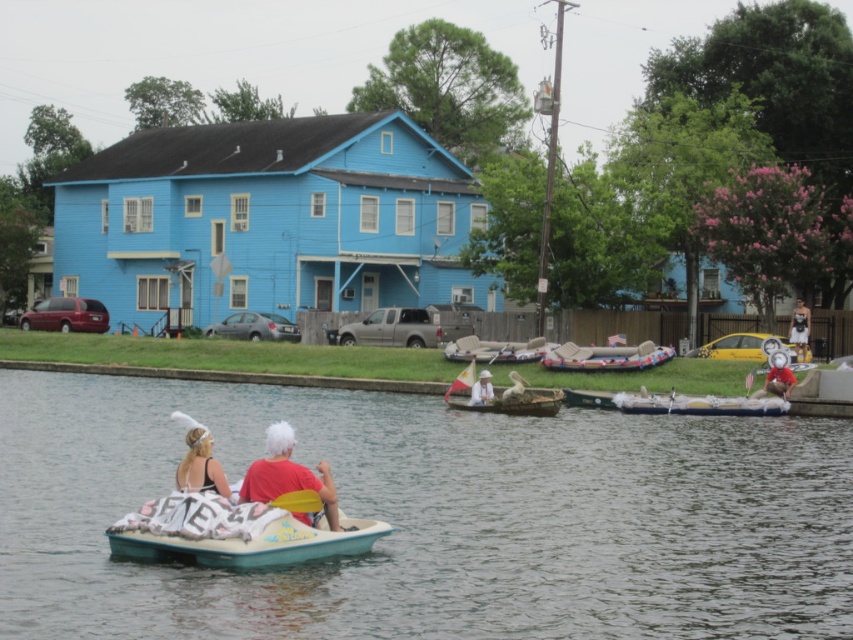
Which is above, red and white striped float at center or white cotton shirt at center?

white cotton shirt at center is above.

This screenshot has height=640, width=853. What do you see at coordinates (605, 356) in the screenshot?
I see `red and white striped float at center` at bounding box center [605, 356].

Find the location of a particular element. red and white striped float at center is located at coordinates (605, 356).

Can you confirm if teal plastic paddle boat at center is positioned to the right of white cotton shirt at center?

In fact, teal plastic paddle boat at center is to the left of white cotton shirt at center.

Who is positioned more to the right, teal plastic paddle boat at center or white cotton shirt at center?

Positioned to the right is white cotton shirt at center.

I want to click on teal plastic paddle boat at center, so click(233, 536).

Where is `teal plastic paddle boat at center`? The image size is (853, 640). teal plastic paddle boat at center is located at coordinates (233, 536).

Which of these two, blue plastic boat at center or matte black swimsuit at lower left, stands shorter?

matte black swimsuit at lower left is shorter.

Is the position of blue plastic boat at center less distant than that of matte black swimsuit at lower left?

Yes, it is in front of matte black swimsuit at lower left.

Describe the element at coordinates (432, 516) in the screenshot. The width and height of the screenshot is (853, 640). I see `blue plastic boat at center` at that location.

Image resolution: width=853 pixels, height=640 pixels. I want to click on blue plastic boat at center, so click(432, 516).